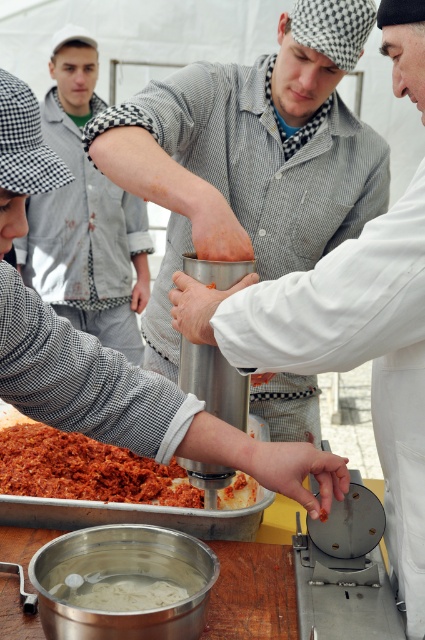
Can you confirm if checkered fabric shirt at center is bigger than matte gray shirt at center?

Correct, checkered fabric shirt at center is larger in size than matte gray shirt at center.

Consider the image. Can you confirm if checkered fabric shirt at center is thinner than matte gray shirt at center?

In fact, checkered fabric shirt at center might be wider than matte gray shirt at center.

Who is more distant from viewer, (289,104) or (218,316)?

Point (289,104)

At what (x,y) coordinates should I click in order to perform the action: click on checkered fabric shirt at center. Please return your answer as a coordinate pair (x, y). This screenshot has height=640, width=425. Looking at the image, I should click on (251, 156).

Does checkered fabric shirt at upper left appear on the right side of shredded red meat at lower left?

Incorrect, checkered fabric shirt at upper left is not on the right side of shredded red meat at lower left.

In the scene shown: Is checkered fabric shirt at upper left smaller than shredded red meat at lower left?

Actually, checkered fabric shirt at upper left might be larger than shredded red meat at lower left.

Is point (96, 268) positioned in front of point (5, 435)?

No, (96, 268) is further to viewer.

Find the location of a particular element. This screenshot has width=425, height=640. checkered fabric shirt at upper left is located at coordinates (85, 216).

Can you confirm if shredded red meat at lower left is bigger than white creamy pasta at lower center?

Indeed, shredded red meat at lower left has a larger size compared to white creamy pasta at lower center.

Identify the location of shredded red meat at lower left. The height and width of the screenshot is (640, 425). (85, 468).